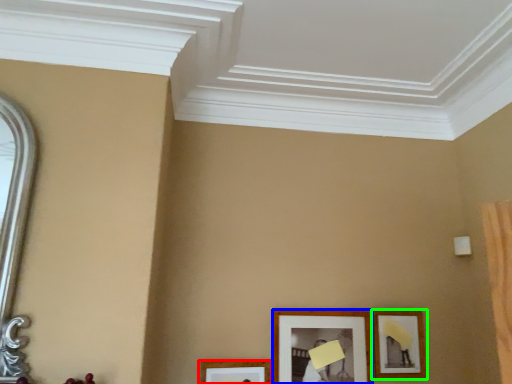
Question: Which object is positioned farthest from picture frame (highlighted by a red box)? Select from picture frame (highlighted by a blue box) and picture frame (highlighted by a green box).

Choices:
 (A) picture frame
 (B) picture frame

Answer: (B)